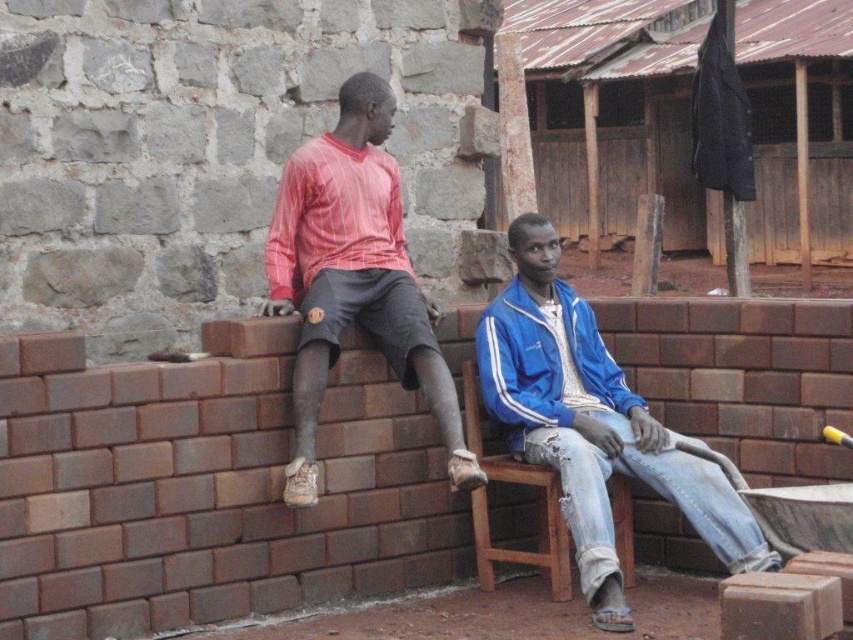
Question: Among these objects, which one is farthest from the camera?

Choices:
 (A) blue fabric jacket at center
 (B) matte red shirt at left
 (C) rusty metal hut at center

Answer: (C)

Question: Is matte red shirt at left to the right of wooden at right from the viewer's perspective?

Choices:
 (A) no
 (B) yes

Answer: (A)

Question: Which object is positioned farthest from the rusty metal hut at center?

Choices:
 (A) wooden at right
 (B) blue fabric jacket at center

Answer: (A)

Question: Is the position of rusty metal hut at center more distant than that of blue fabric jacket at center?

Choices:
 (A) yes
 (B) no

Answer: (A)

Question: Which is farther from the blue fabric jacket at center?

Choices:
 (A) rusty metal hut at center
 (B) matte red shirt at left
 (C) wooden at right

Answer: (A)

Question: Can you confirm if blue fabric jacket at center is positioned below matte red shirt at left?

Choices:
 (A) no
 (B) yes

Answer: (B)